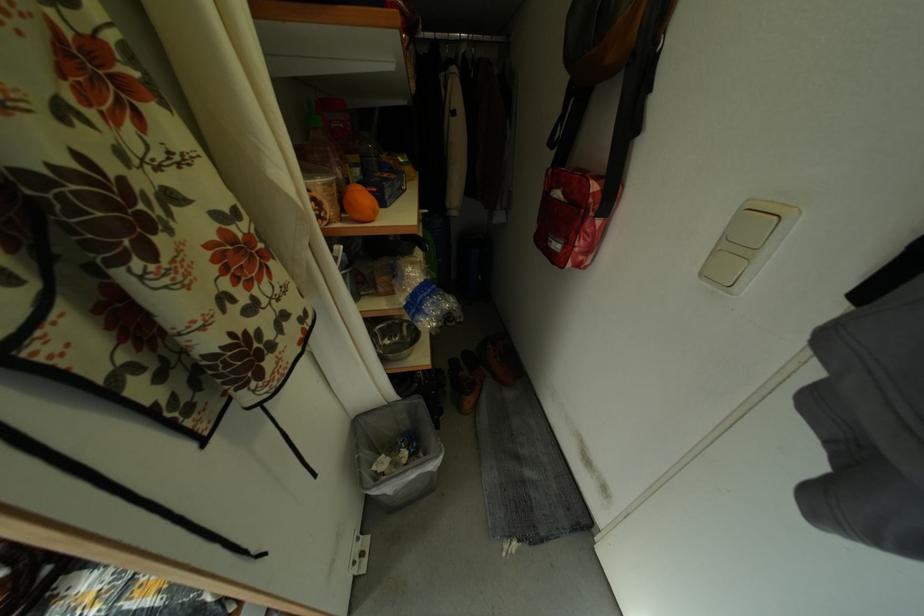
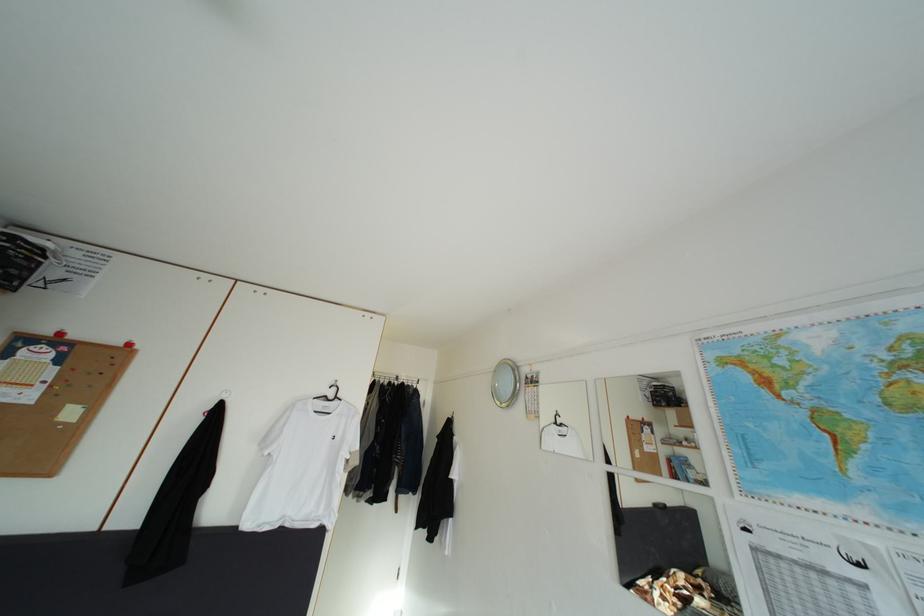
Question: I am providing you with two images of the same scene from different viewpoints. Which of the following objects are not visible in image2?

Choices:
 (A) orange fruit
 (B) small cabinet knob
 (C) red toilet brush handle
 (D) white clothes hanger

Answer: (A)